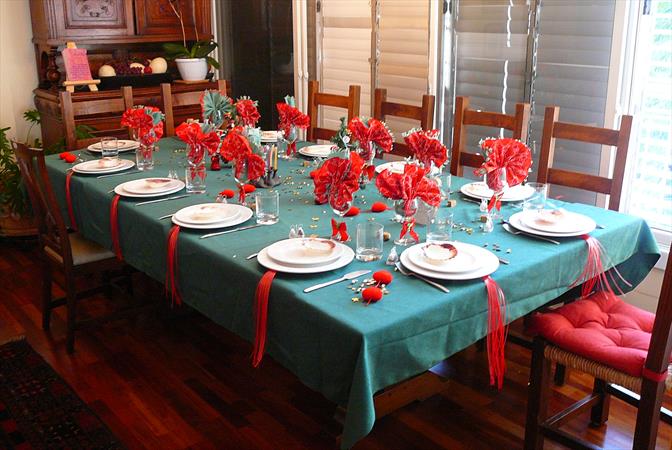
Where is `wooden chairs`? wooden chairs is located at coordinates (593, 133), (497, 118), (413, 108), (345, 99), (181, 95), (116, 96), (33, 150), (668, 288).